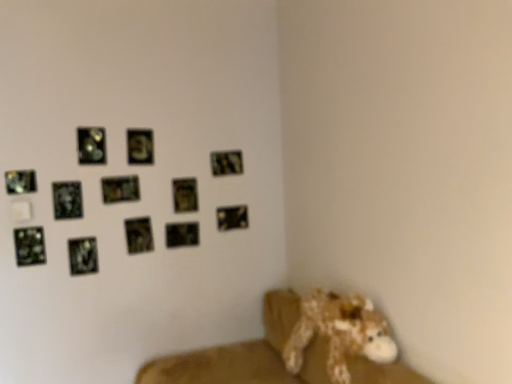
Find the location of a particular element. The height and width of the screenshot is (384, 512). fuzzy brown stuffed animal at lower right is located at coordinates (340, 332).

In order to face metallic reflective picture frame at upper left, which is the 4th picture frame from left to right, should I rotate leftwards or rightwards?

It's best to rotate left around 21.391 degrees.

At what (x,y) coordinates should I click in order to perform the action: click on metallic reflective picture frame at upper left, acting as the ninth picture frame starting from the right. Please return your answer as a coordinate pair (x, y). Looking at the image, I should click on (83, 256).

Find the location of `metallic silver picture frame at center, the seventh picture frame when ordered from left to right`. metallic silver picture frame at center, the seventh picture frame when ordered from left to right is located at coordinates (139, 235).

How much space does metallic reflective picture frame at upper left, placed as the 8th picture frame when sorted from right to left, occupy vertically?

The height of metallic reflective picture frame at upper left, placed as the 8th picture frame when sorted from right to left, is 8.47 inches.

What is the approximate width of metallic reflective picture frame at upper left, which is counted as the fifth picture frame, starting from the left?

metallic reflective picture frame at upper left, which is counted as the fifth picture frame, starting from the left, is 1.56 centimeters in width.

Identify the location of brown plush toy at lower right. (246, 354).

Considering the relative positions of metallic gold picture frame at upper center, which is the tenth picture frame in left-to-right order, and metallic reflective picture frame at upper center, which ranks as the seventh picture frame in right-to-left order, in the image provided, is metallic gold picture frame at upper center, which is the tenth picture frame in left-to-right order, to the left or to the right of metallic reflective picture frame at upper center, which ranks as the seventh picture frame in right-to-left order,?

Clearly, metallic gold picture frame at upper center, which is the tenth picture frame in left-to-right order, is on the right of metallic reflective picture frame at upper center, which ranks as the seventh picture frame in right-to-left order, in the image.

Can you confirm if metallic gold picture frame at upper center, which is counted as the 3th picture frame, starting from the right, is taller than metallic reflective picture frame at upper center, which ranks as the seventh picture frame in right-to-left order?

Correct, metallic gold picture frame at upper center, which is counted as the 3th picture frame, starting from the right, is much taller as metallic reflective picture frame at upper center, which ranks as the seventh picture frame in right-to-left order.

Considering the points (194, 201) and (134, 191), which point is in front, point (194, 201) or point (134, 191)?

The point (134, 191) is in front.

Is metallic reflective picture frame at upper left, which is counted as the fifth picture frame, starting from the left, aimed at metallic silver picture frame at upper center, which is the 4th picture frame in right-to-left order?

No, metallic reflective picture frame at upper left, which is counted as the fifth picture frame, starting from the left, is not turned towards metallic silver picture frame at upper center, which is the 4th picture frame in right-to-left order.

Between metallic reflective picture frame at upper left, which is counted as the fifth picture frame, starting from the left, and metallic silver picture frame at upper center, which is the ninth picture frame from left to right, which one has more height?

With more height is metallic reflective picture frame at upper left, which is counted as the fifth picture frame, starting from the left.

Are metallic reflective picture frame at upper left, placed as the 8th picture frame when sorted from right to left, and metallic silver picture frame at upper center, which is the 4th picture frame in right-to-left order, far apart?

metallic reflective picture frame at upper left, placed as the 8th picture frame when sorted from right to left, is actually quite close to metallic silver picture frame at upper center, which is the 4th picture frame in right-to-left order.

How different are the orientations of metallic silver picture frame at upper center, which is the ninth picture frame from left to right, and fuzzy brown stuffed animal at lower right in degrees?

The angle between the facing direction of metallic silver picture frame at upper center, which is the ninth picture frame from left to right, and the facing direction of fuzzy brown stuffed animal at lower right is 89.8 degrees.

Considering the relative sizes of metallic silver picture frame at upper center, which is the ninth picture frame from left to right, and fuzzy brown stuffed animal at lower right in the image provided, is metallic silver picture frame at upper center, which is the ninth picture frame from left to right, smaller than fuzzy brown stuffed animal at lower right?

Yes.

Choose the correct answer: Is metallic silver picture frame at upper center, which is the 4th picture frame in right-to-left order, inside fuzzy brown stuffed animal at lower right or outside it?

metallic silver picture frame at upper center, which is the 4th picture frame in right-to-left order, lies outside fuzzy brown stuffed animal at lower right.

Is the depth of metallic silver picture frame at upper center, which is the 4th picture frame in right-to-left order, less than that of fuzzy brown stuffed animal at lower right?

That is False.

Is metallic reflective picture frame at upper left, placed as the 8th picture frame when sorted from right to left, aimed at metallic silver picture frame at upper left, acting as the tenth picture frame starting from the right?

No, metallic reflective picture frame at upper left, placed as the 8th picture frame when sorted from right to left, is not turned towards metallic silver picture frame at upper left, acting as the tenth picture frame starting from the right.

Are metallic reflective picture frame at upper left, which is counted as the fifth picture frame, starting from the left, and metallic silver picture frame at upper left, the third picture frame in the left-to-right sequence, making contact?

metallic reflective picture frame at upper left, which is counted as the fifth picture frame, starting from the left, and metallic silver picture frame at upper left, the third picture frame in the left-to-right sequence, are not in contact.

Who is smaller, metallic reflective picture frame at upper left, placed as the 8th picture frame when sorted from right to left, or metallic silver picture frame at upper left, acting as the tenth picture frame starting from the right?

metallic reflective picture frame at upper left, placed as the 8th picture frame when sorted from right to left.

Which object is closer to the camera, metallic reflective picture frame at upper left, placed as the 8th picture frame when sorted from right to left, or metallic silver picture frame at upper left, acting as the tenth picture frame starting from the right?

Positioned in front is metallic silver picture frame at upper left, acting as the tenth picture frame starting from the right.

Is gold metallic picture frame at upper center, placed as the fifth picture frame when sorted from right to left, oriented away from metallic silver picture frame at upper center, which is the ninth picture frame from left to right?

That's not correct — gold metallic picture frame at upper center, placed as the fifth picture frame when sorted from right to left, is not looking away from metallic silver picture frame at upper center, which is the ninth picture frame from left to right.

Considering their positions, is gold metallic picture frame at upper center, placed as the fifth picture frame when sorted from right to left, located in front of or behind metallic silver picture frame at upper center, which is the 4th picture frame in right-to-left order?

Clearly, gold metallic picture frame at upper center, placed as the fifth picture frame when sorted from right to left, is in front of metallic silver picture frame at upper center, which is the 4th picture frame in right-to-left order.

Can we say gold metallic picture frame at upper center, arranged as the eighth picture frame when viewed from the left, lies outside metallic silver picture frame at upper center, which is the 4th picture frame in right-to-left order?

Yes, gold metallic picture frame at upper center, arranged as the eighth picture frame when viewed from the left, is outside of metallic silver picture frame at upper center, which is the 4th picture frame in right-to-left order.

Considering the positions of objects gold metallic picture frame at upper center, arranged as the eighth picture frame when viewed from the left, and metallic silver picture frame at upper center, which is the 4th picture frame in right-to-left order, in the image provided, who is more to the left, gold metallic picture frame at upper center, arranged as the eighth picture frame when viewed from the left, or metallic silver picture frame at upper center, which is the 4th picture frame in right-to-left order,?

From the viewer's perspective, gold metallic picture frame at upper center, arranged as the eighth picture frame when viewed from the left, appears more on the left side.

Is metallic reflective picture frame at upper center, placed as the sixth picture frame when sorted from left to right, oriented away from metallic reflective picture frame at upper left, acting as the ninth picture frame starting from the right?

That's not correct — metallic reflective picture frame at upper center, placed as the sixth picture frame when sorted from left to right, is not looking away from metallic reflective picture frame at upper left, acting as the ninth picture frame starting from the right.

Identify the location of picture frame that is the 7th one when counting downward from the metallic reflective picture frame at upper center, placed as the sixth picture frame when sorted from left to right (from the image's perspective). This screenshot has height=384, width=512. (83, 256).

Are metallic reflective picture frame at upper center, which ranks as the seventh picture frame in right-to-left order, and metallic reflective picture frame at upper left, which is the 4th picture frame from left to right, making contact?

No, metallic reflective picture frame at upper center, which ranks as the seventh picture frame in right-to-left order, is not with metallic reflective picture frame at upper left, which is the 4th picture frame from left to right.

Would you say metallic reflective picture frame at upper center, which ranks as the seventh picture frame in right-to-left order, contains metallic reflective picture frame at upper left, acting as the ninth picture frame starting from the right?

No.

Considering the sizes of objects metallic silver picture frame at upper right, arranged as the second picture frame when viewed from the right, and brown plush toy at lower right in the image provided, who is shorter, metallic silver picture frame at upper right, arranged as the second picture frame when viewed from the right, or brown plush toy at lower right?

metallic silver picture frame at upper right, arranged as the second picture frame when viewed from the right.

Could you measure the distance between metallic silver picture frame at upper right, arranged as the second picture frame when viewed from the right, and brown plush toy at lower right?

A distance of 1.04 meters exists between metallic silver picture frame at upper right, arranged as the second picture frame when viewed from the right, and brown plush toy at lower right.

Is metallic silver picture frame at upper right, arranged as the eleventh picture frame when viewed from the left, positioned far away from brown plush toy at lower right?

metallic silver picture frame at upper right, arranged as the eleventh picture frame when viewed from the left, is positioned a significant distance from brown plush toy at lower right.

How different are the orientations of metallic silver picture frame at upper right, arranged as the eleventh picture frame when viewed from the left, and brown plush toy at lower right in degrees?

91.6 degrees.

Locate an element on the screen. This screenshot has height=384, width=512. picture frame that is the 2nd object directly below the metallic reflective picture frame at upper center, which ranks as the seventh picture frame in right-to-left order (from a real-world perspective) is located at coordinates (185, 195).

Locate an element on the screen. The image size is (512, 384). picture frame that is the 8th object located above the metallic silver picture frame at upper center, which is the 4th picture frame in right-to-left order (from the image's perspective) is located at coordinates (91, 145).

When comparing their distances from metallic reflective picture frame at upper center, which ranks as the seventh picture frame in right-to-left order, does metallic reflective picture frame at upper left, which appears as the 12th picture frame when viewed from the right, or brown plush toy at lower right seem further?

Based on the image, brown plush toy at lower right appears to be further to metallic reflective picture frame at upper center, which ranks as the seventh picture frame in right-to-left order.

From the image, which object appears to be farther from metallic silver picture frame at upper right, arranged as the eleventh picture frame when viewed from the left, metallic reflective picture frame at upper center, which ranks as the seventh picture frame in right-to-left order, or metallic reflective picture frame at upper left, which is the first picture frame from left to right?

metallic reflective picture frame at upper left, which is the first picture frame from left to right.

Considering their positions, is metallic silver picture frame at upper right, arranged as the second picture frame when viewed from the right, positioned further to metallic reflective picture frame at upper center, the twelfth picture frame from the left, than gold metallic picture frame at upper center, placed as the fifth picture frame when sorted from right to left?

Among the two, gold metallic picture frame at upper center, placed as the fifth picture frame when sorted from right to left, is located further to metallic reflective picture frame at upper center, the twelfth picture frame from the left.

Based on their spatial positions, is gold metallic picture frame at upper center, placed as the fifth picture frame when sorted from right to left, or metallic gold picture frame at upper center, which is the tenth picture frame in left-to-right order, further from brown plush toy at lower right?

Among the two, gold metallic picture frame at upper center, placed as the fifth picture frame when sorted from right to left, is located further to brown plush toy at lower right.

Based on their spatial positions, is brown plush toy at lower right or gold metallic picture frame at upper center, arranged as the eighth picture frame when viewed from the left, further from metallic silver picture frame at upper center, which is the 4th picture frame in right-to-left order?

brown plush toy at lower right lies further to metallic silver picture frame at upper center, which is the 4th picture frame in right-to-left order, than the other object.

In the scene shown: Considering their positions, is metallic reflective picture frame at lower left, which is counted as the 11th picture frame, starting from the right, positioned further to metallic reflective picture frame at upper center, placed as the sixth picture frame when sorted from left to right, than metallic gold picture frame at upper center, which is counted as the 3th picture frame, starting from the right?

Among the two, metallic reflective picture frame at lower left, which is counted as the 11th picture frame, starting from the right, is located further to metallic reflective picture frame at upper center, placed as the sixth picture frame when sorted from left to right.

From the image, which object appears to be nearer to metallic silver picture frame at upper left, acting as the tenth picture frame starting from the right, fuzzy brown stuffed animal at lower right or metallic reflective picture frame at upper left, which is counted as the fifth picture frame, starting from the left?

Among the two, metallic reflective picture frame at upper left, which is counted as the fifth picture frame, starting from the left, is located nearer to metallic silver picture frame at upper left, acting as the tenth picture frame starting from the right.

Looking at the image, which one is located further to metallic silver picture frame at center, positioned as the 6th picture frame in right-to-left order, metallic reflective picture frame at upper left, placed as the 8th picture frame when sorted from right to left, or metallic reflective picture frame at upper center, which ranks as the seventh picture frame in right-to-left order?

metallic reflective picture frame at upper left, placed as the 8th picture frame when sorted from right to left, lies further to metallic silver picture frame at center, positioned as the 6th picture frame in right-to-left order, than the other object.

I want to click on animal between brown plush toy at lower right and metallic gold picture frame at upper center, which is counted as the 3th picture frame, starting from the right, along the z-axis, so click(x=340, y=332).

You are a GUI agent. You are given a task and a screenshot of the screen. Output one action in this format:
    pyautogui.click(x=<x>, y=<y>)
    Task: Click on the animal between brown plush toy at lower right and metallic reflective picture frame at upper center, marked as the first picture frame in a right-to-left arrangement, from front to back
    This screenshot has width=512, height=384.
    Given the screenshot: What is the action you would take?
    pyautogui.click(x=340, y=332)

Find the location of a particular element. animal between brown plush toy at lower right and metallic silver picture frame at center, the seventh picture frame when ordered from left to right, in the front-back direction is located at coordinates (340, 332).

In order to click on animal between metallic reflective picture frame at upper left, which is counted as the fifth picture frame, starting from the left, and brown plush toy at lower right vertically in this screenshot , I will do `click(340, 332)`.